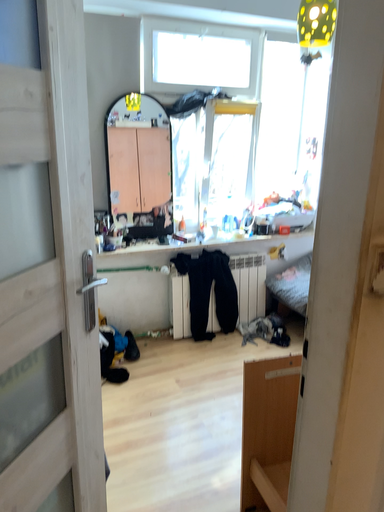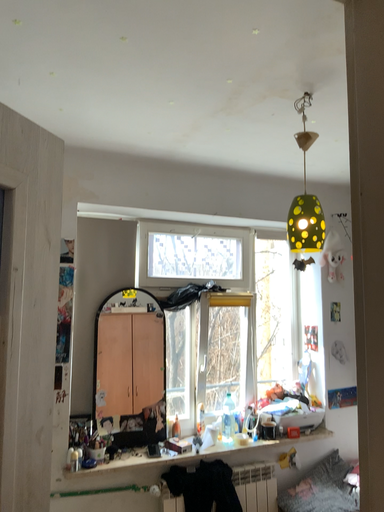
Question: Which way did the camera rotate in the video?

Choices:
 (A) rotated upward
 (B) rotated downward

Answer: (A)